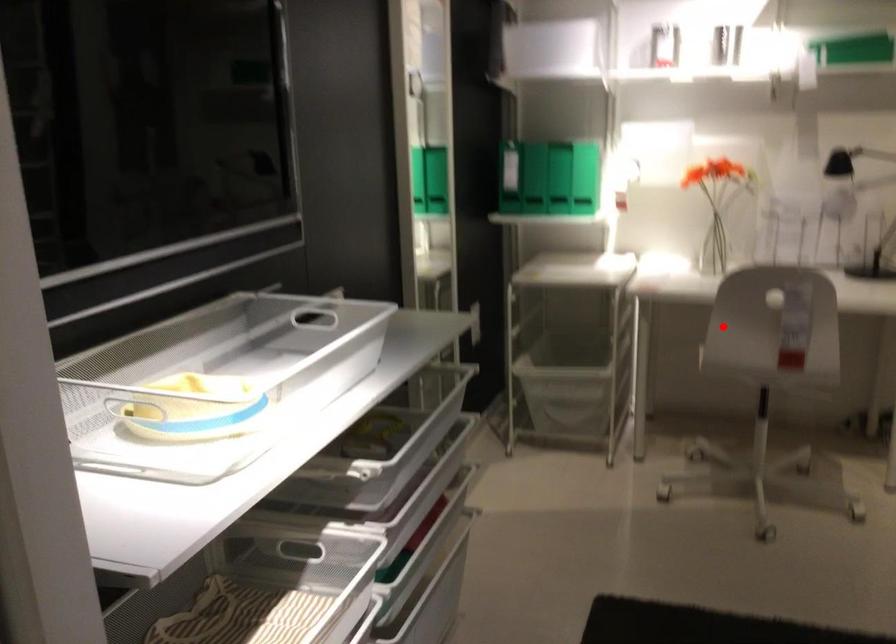
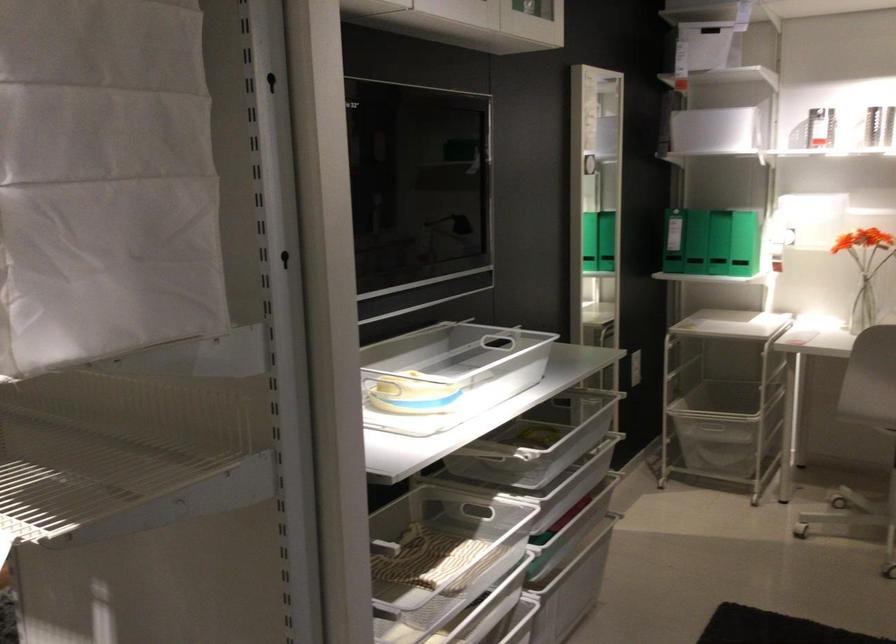
In the second image, find the point that corresponds to the highlighted location in the first image.

(869, 379)